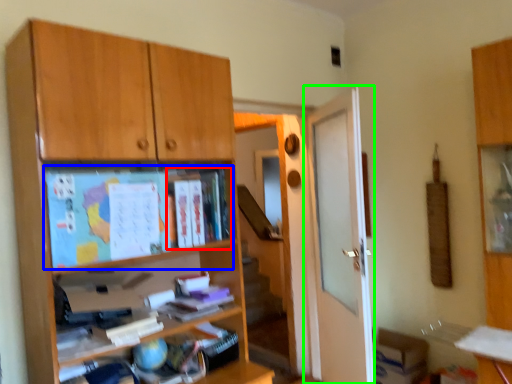
Question: Which is farther away from book (highlighted by a red box)? paperback book (highlighted by a blue box) or door (highlighted by a green box)?

Choices:
 (A) paperback book
 (B) door

Answer: (B)